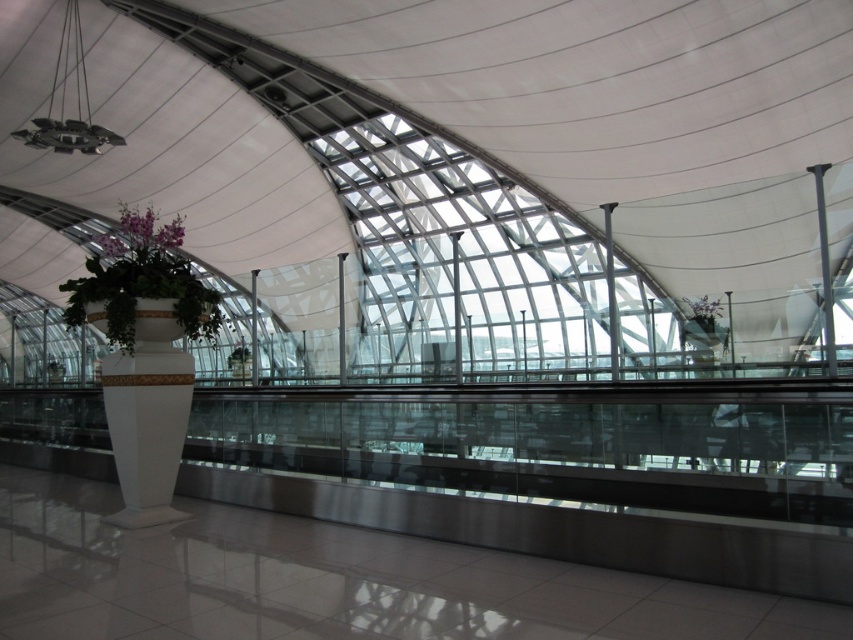
You are standing in the modern interior space and see the point marked at coordinates [141,282]. Based on the scene description, what object is this point located on?

The point at coordinates [141,282] is located on the white glossy planter at center.

You are an interior designer planning to place a decorative item between the purple matte orchid at upper left and the purple matte flower at upper right. Considering their sizes, which flower should you avoid placing the item next to to ensure it doesn t get overcrowded?

You should avoid placing the decorative item next to the purple matte orchid at upper left because its width is larger than the purple matte flower at upper right, which could cause overcrowding.